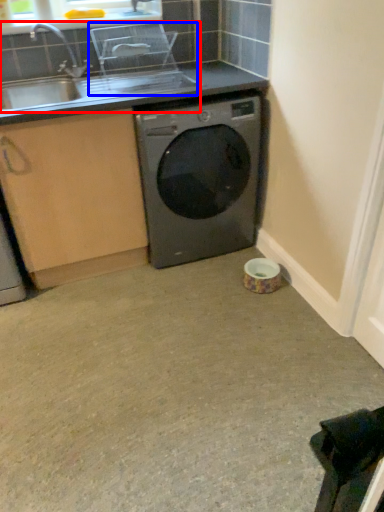
Question: Among these objects, which one is farthest to the camera, sink (highlighted by a red box) or appliance (highlighted by a blue box)?

Choices:
 (A) sink
 (B) appliance

Answer: (B)